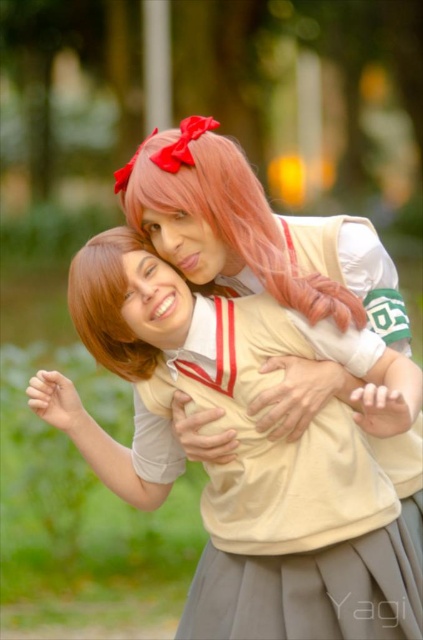
Question: Is the position of matte beige uniform at center less distant than that of pink silky wig at upper center?

Choices:
 (A) no
 (B) yes

Answer: (B)

Question: Which point is closer to the camera taking this photo?

Choices:
 (A) (381, 410)
 (B) (329, 296)

Answer: (A)

Question: Does matte beige uniform at center have a larger size compared to pink silky wig at upper center?

Choices:
 (A) yes
 (B) no

Answer: (A)

Question: Which of the following is the closest to the observer?

Choices:
 (A) matte beige uniform at center
 (B) pink silky wig at upper center

Answer: (A)

Question: Does matte beige uniform at center have a smaller size compared to pink silky wig at upper center?

Choices:
 (A) yes
 (B) no

Answer: (B)

Question: Among these objects, which one is farthest from the camera?

Choices:
 (A) pink silky wig at upper center
 (B) matte beige uniform at center

Answer: (A)